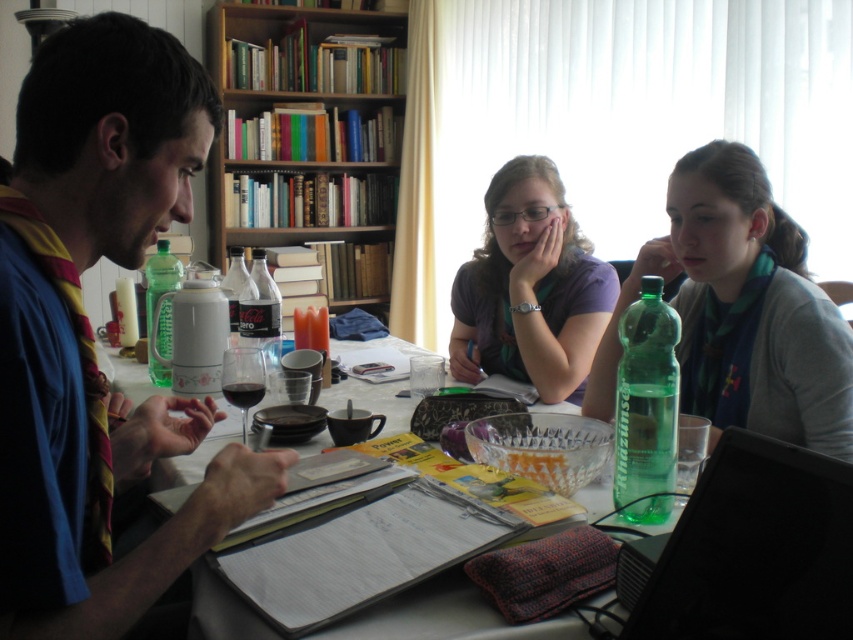
Is black plastic laptop at lower right wider than green translucent bottle at right?

Yes, black plastic laptop at lower right is wider than green translucent bottle at right.

Does point (734, 552) lie in front of point (651, 509)?

Yes, point (734, 552) is in front of point (651, 509).

The height and width of the screenshot is (640, 853). In order to click on black plastic laptop at lower right in this screenshot , I will do point(755,548).

Find the location of `black plastic laptop at lower right`. black plastic laptop at lower right is located at coordinates (755, 548).

Between point (759, 321) and point (817, 492), which one is positioned in front?

Point (817, 492)

Based on the photo, does gray fabric scarf at right have a greater height compared to black plastic laptop at lower right?

Yes.

Find the location of a particular element. The height and width of the screenshot is (640, 853). gray fabric scarf at right is located at coordinates (740, 310).

Find the location of a particular element. gray fabric scarf at right is located at coordinates (740, 310).

Does black plastic laptop at lower right appear on the right side of clear plastic bottle at center?

Correct, you'll find black plastic laptop at lower right to the right of clear plastic bottle at center.

Does black plastic laptop at lower right have a larger size compared to clear plastic bottle at center?

Actually, black plastic laptop at lower right might be smaller than clear plastic bottle at center.

Is point (640, 596) in front of point (231, 292)?

Yes, point (640, 596) is in front of point (231, 292).

Identify the location of black plastic laptop at lower right. The width and height of the screenshot is (853, 640). (755, 548).